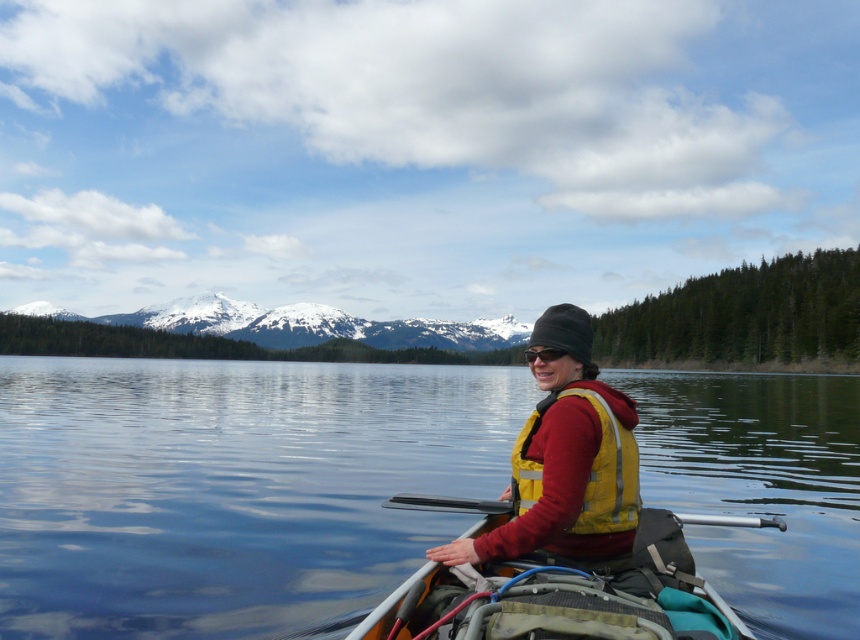
Does transparent water at center have a greater height compared to silver metallic paddle at center?

Indeed, transparent water at center has a greater height compared to silver metallic paddle at center.

Which of these two, transparent water at center or silver metallic paddle at center, stands taller?

transparent water at center is taller.

Does point (837, 387) come closer to viewer compared to point (691, 522)?

No, (837, 387) is further to viewer.

Locate an element on the screen. transparent water at center is located at coordinates (231, 488).

Which of these two, transparent water at center or yellow reflective life vest at center, stands shorter?

yellow reflective life vest at center is shorter.

Who is taller, transparent water at center or yellow reflective life vest at center?

Standing taller between the two is transparent water at center.

Is point (794, 538) positioned behind point (458, 557)?

Yes, it is.

In order to click on transparent water at center in this screenshot , I will do `click(231, 488)`.

Between yellow reflective life vest at center and silver metallic paddle at center, which one is positioned higher?

Positioned higher is yellow reflective life vest at center.

Who is more distant from viewer, (625,515) or (752,518)?

The point (752,518) is behind.

Is point (507, 531) positioned behind point (711, 515)?

No, (507, 531) is closer to viewer.

Locate an element on the screen. yellow reflective life vest at center is located at coordinates (566, 458).